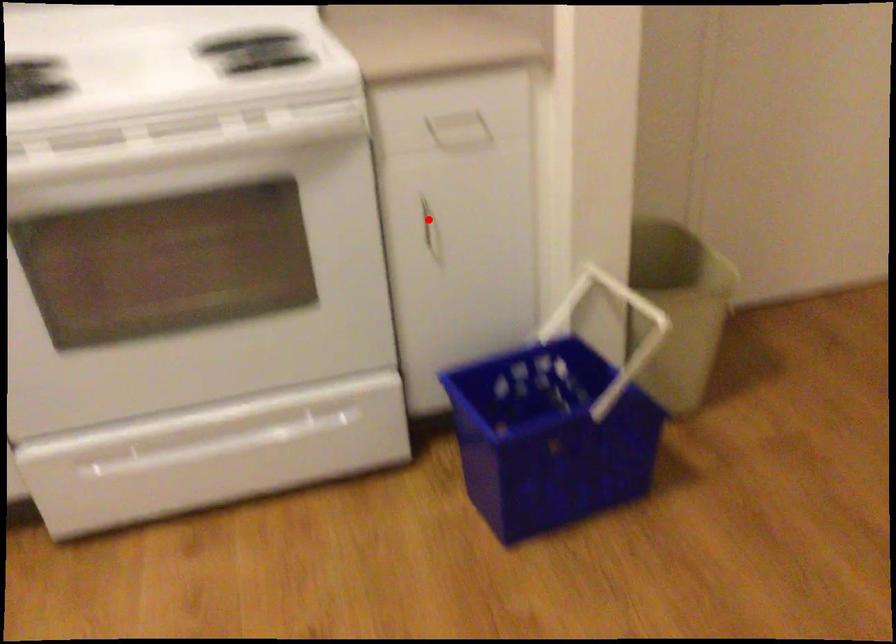
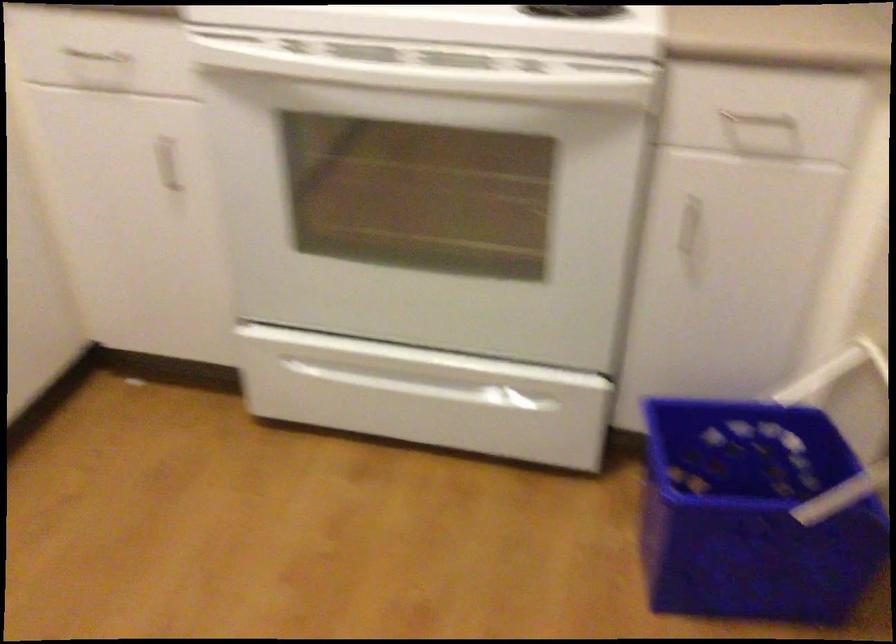
Question: I am providing you with two images of the same scene from different viewpoints. Image1 has a red point marked. In image2, the corresponding 3D location appears at what relative position? Reply with the corresponding letter.

Choices:
 (A) Closer
 (B) Farther

Answer: (A)